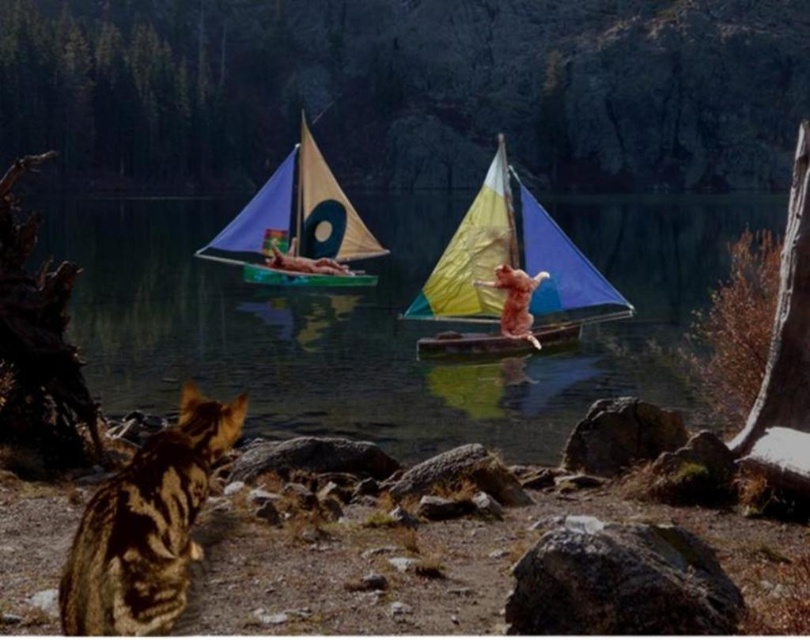
You are a photographer trying to capture the matte yellow sailboat at center from the lakeside. However, you notice the transparent plastic water at center is blocking your view. Can you adjust your position to see the boat clearly?

The transparent plastic water at center is in front of the matte yellow sailboat at center, so moving your position slightly to the side or adjusting the angle of your camera should allow you to see the boat through the water or around the obstruction.

In the serene lakeside scene, there is a tabby fur cat at lower left and a matte yellow sailboat at center. Which object is smaller in height?

The tabby fur cat at lower left is shorter than the matte yellow sailboat at center, so the tabby fur cat at lower left is smaller in height.

You are planning to take a nap on the wooden canoe at center. Considering the tabby fur cat at lower left is also present, will there be enough space for you to lie down comfortably?

The tabby fur cat at lower left has a smaller size compared to wooden canoe at center, so there should be enough space for you to lie down comfortably on the wooden canoe at center.